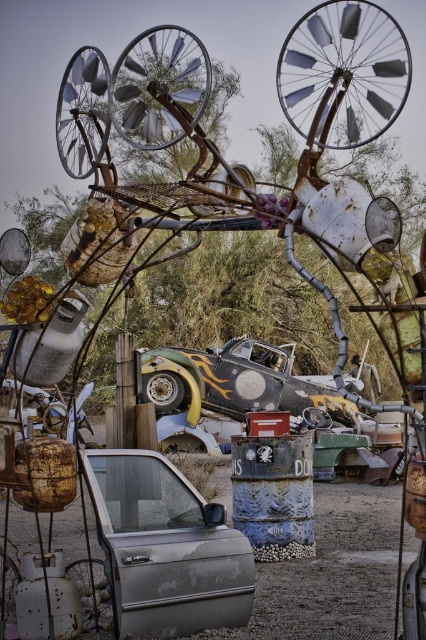
You are a delivery robot with a package that needs to be placed between the silver metallic car door at center and the painted metal car at center. The package requires a minimum of 2 meters of space. Can you fit it there?

The silver metallic car door at center and painted metal car at center are 18.07 meters apart, so yes, the delivery robot can fit the package between them as the distance is more than sufficient.